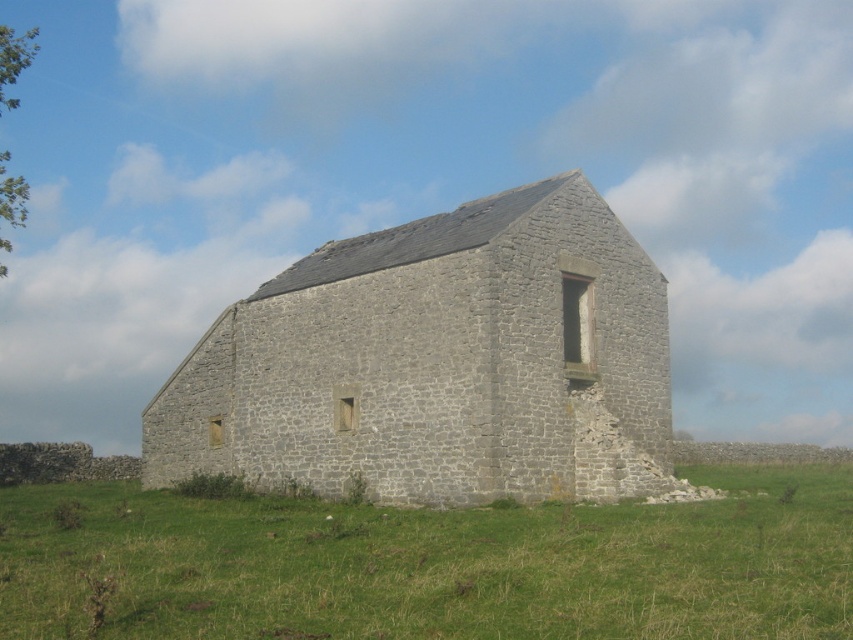
You are standing in a field and see the gray stone church at center and the green grass at lower center. Which object is higher in the image?

The gray stone church at center is higher than the green grass at lower center.

You are planning to build a small garden in the area shown in the image. The garden requires a space wider than the gray stone church at center. Can the green grass at lower center accommodate this requirement?

The gray stone church at center is narrower than the green grass at lower center, so yes, the green grass at lower center can accommodate the garden as it is wider than the church.